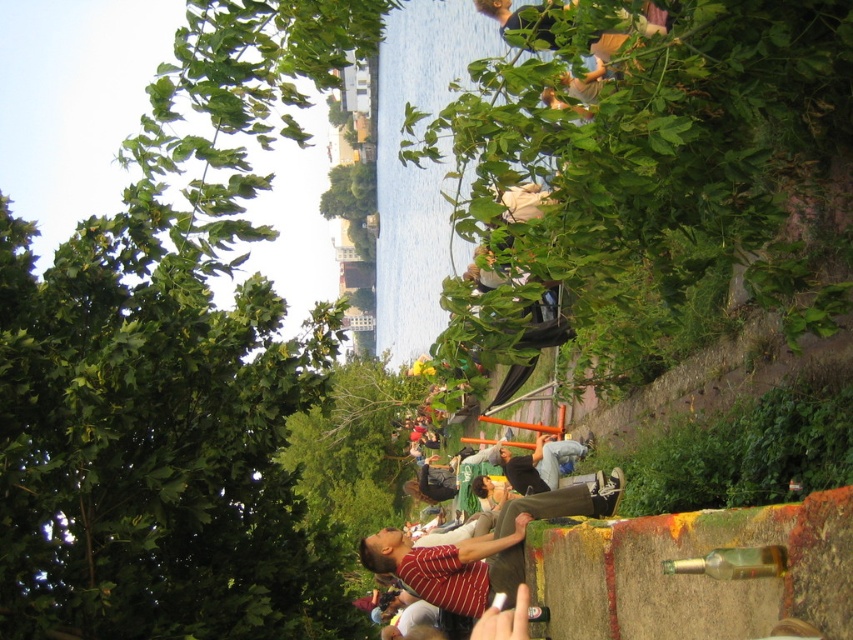
You are a photographer trying to capture a balanced composition. You have to include both the green leafy tree at upper left and the dark gray fabric pants at center. Which object should you focus on to maintain balance given their sizes?

The green leafy tree at upper left is larger in size than the dark gray fabric pants at center, so focusing on the smaller dark gray fabric pants at center would help balance the composition.